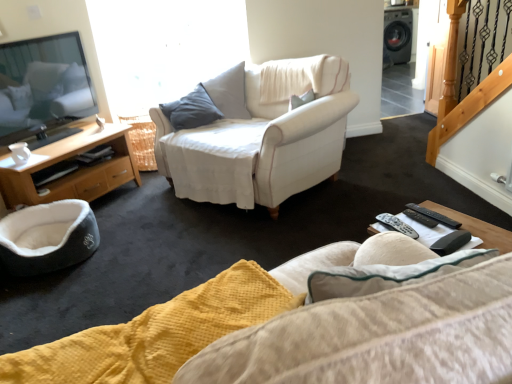
Question: Is black plastic remote at lower right, positioned as the third remote in right-to-left order, bigger or smaller than black plastic remote at lower right, acting as the third remote starting from the left?

Choices:
 (A) big
 (B) small

Answer: (A)

Question: Is black plastic remote at lower right, positioned as the third remote in right-to-left order, spatially inside black plastic remote at lower right, acting as the third remote starting from the left, or outside of it?

Choices:
 (A) inside
 (B) outside

Answer: (B)

Question: Which of these objects is positioned closest to the black plastic remote control at lower right?

Choices:
 (A) black plastic remote at lower right, the 2th remote viewed from the right
 (B) wooden cabinet at left
 (C) dark gray plush pet bed at lower left
 (D) yellow textured fabric studio couch at lower center
 (E) black plastic remote at lower right, which is the first remote in right-to-left order

Answer: (E)

Question: Estimate the real-world distances between objects in this image. Which object is farther from the black plastic remote control at lower right?

Choices:
 (A) white fabric chair at center
 (B) dark gray plush pet bed at lower left
 (C) black plastic remote at lower right, the 1th remote when ordered from left to right
 (D) black plastic remote at lower right, which is the first remote in right-to-left order
 (E) wooden cabinet at left

Answer: (E)